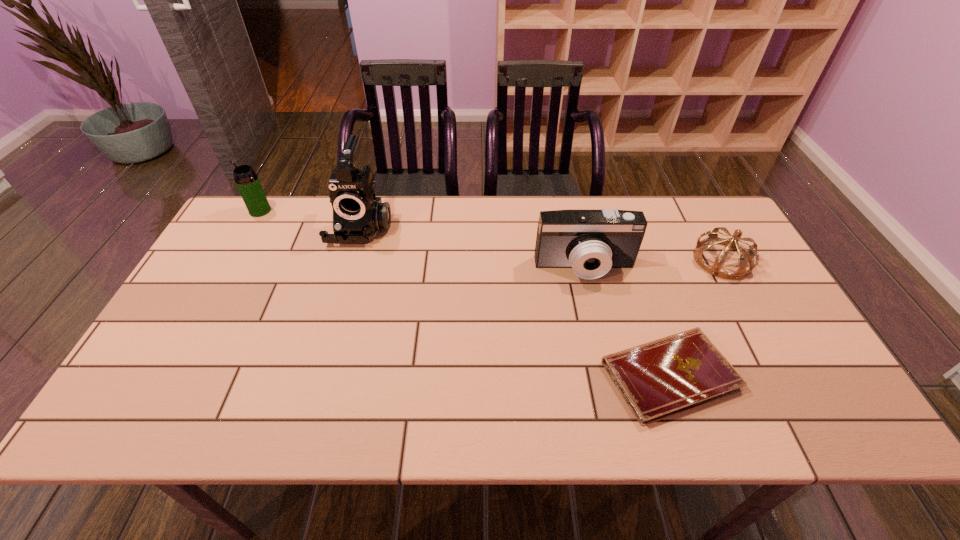
Where is `vacant space that is in between the thermos bottle and the taller camcorder`? The height and width of the screenshot is (540, 960). vacant space that is in between the thermos bottle and the taller camcorder is located at coordinates (311, 218).

The image size is (960, 540). What are the coordinates of `free space between the second shortest object and the right camcorder` in the screenshot? It's located at pyautogui.click(x=654, y=264).

What are the coordinates of `vacant area between the taller camcorder and the nearer camcorder` in the screenshot? It's located at (473, 247).

Locate an element on the screen. vacant area that lies between the rightmost object and the shorter camcorder is located at coordinates (654, 264).

Locate an element on the screen. free space between the tiara and the right camcorder is located at coordinates (654, 264).

I want to click on vacant space that's between the leftmost object and the right camcorder, so click(x=422, y=239).

Select which object is the closest to the fourth tallest object. Please provide its 2D coordinates. Your answer should be formatted as a tuple, i.e. [(x, y)], where the tuple contains the x and y coordinates of a point satisfying the conditions above.

[(659, 379)]

I want to click on object identified as the second closest to the nearer camcorder, so click(x=745, y=255).

I want to click on free space that satisfies the following two spatial constraints: 1. on the lens of the shorter camcorder; 2. on the left side of the shortest object, so click(610, 375).

Identify the location of vacant space that satisfies the following two spatial constraints: 1. on the lens of the nearer camcorder; 2. on the left side of the shortest object. This screenshot has width=960, height=540. pyautogui.click(x=610, y=375).